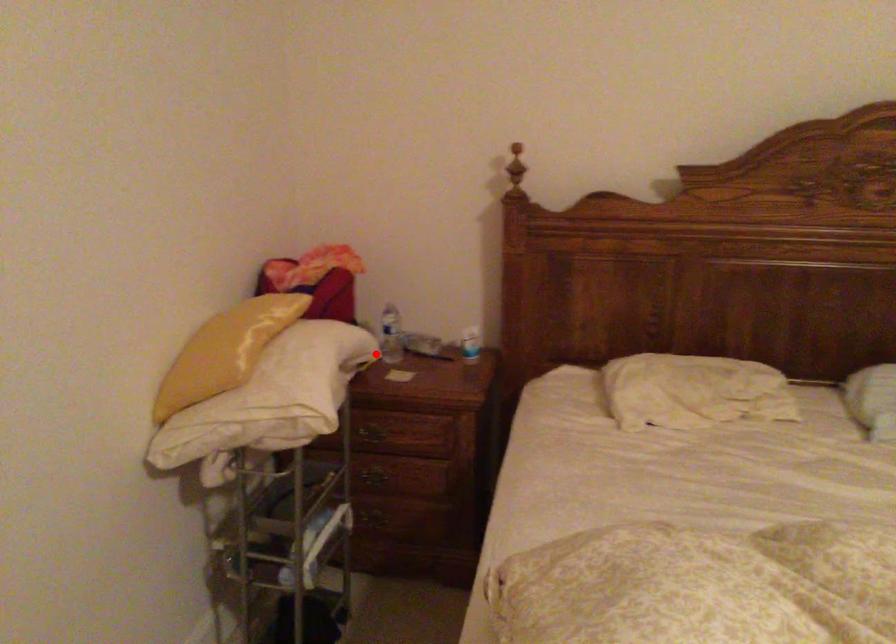
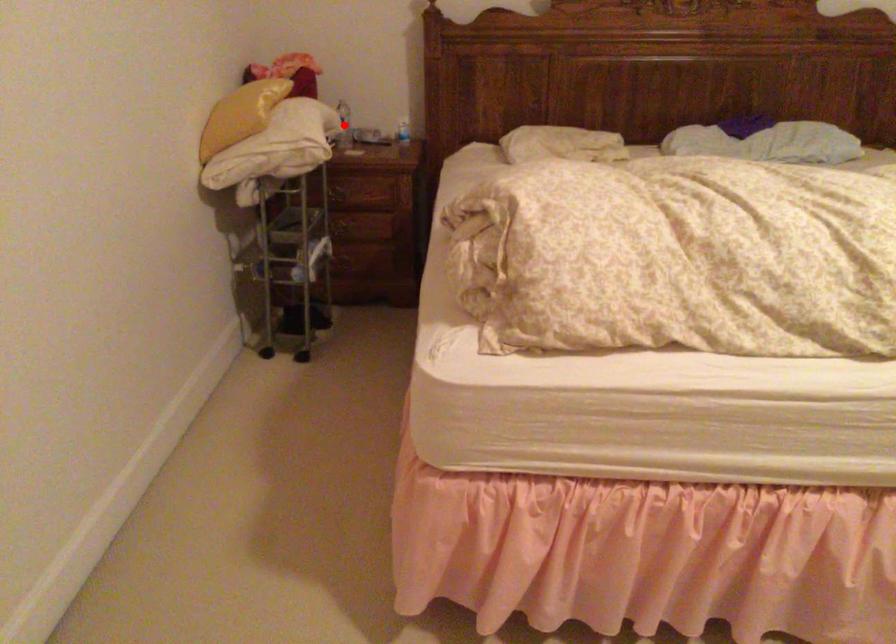
I am providing you with two images of the same scene from different viewpoints. A red point is marked on the first image and another point is marked on the second image. Does the point marked in image1 correspond to the same location as the one in image2?

Yes